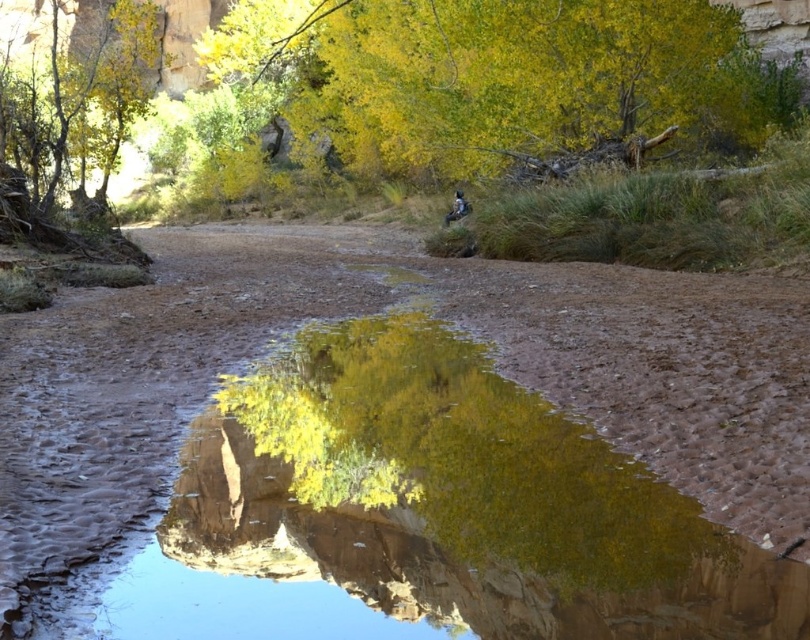
Question: Does clear water at center have a smaller size compared to yellow-green foliage at upper left?

Choices:
 (A) no
 (B) yes

Answer: (B)

Question: Can you confirm if clear water at center is positioned below yellow leafy tree at upper center?

Choices:
 (A) yes
 (B) no

Answer: (A)

Question: Which object is positioned closest to the yellow-green foliage at upper left?

Choices:
 (A) clear water at center
 (B) yellow leafy tree at upper center

Answer: (B)

Question: Is clear water at center positioned in front of yellow leafy tree at upper center?

Choices:
 (A) no
 (B) yes

Answer: (B)

Question: Which of the following is the farthest from the observer?

Choices:
 (A) (52, 17)
 (B) (486, 22)

Answer: (A)

Question: Which object is the closest to the yellow-green foliage at upper left?

Choices:
 (A) yellow leafy tree at upper center
 (B) clear water at center

Answer: (A)